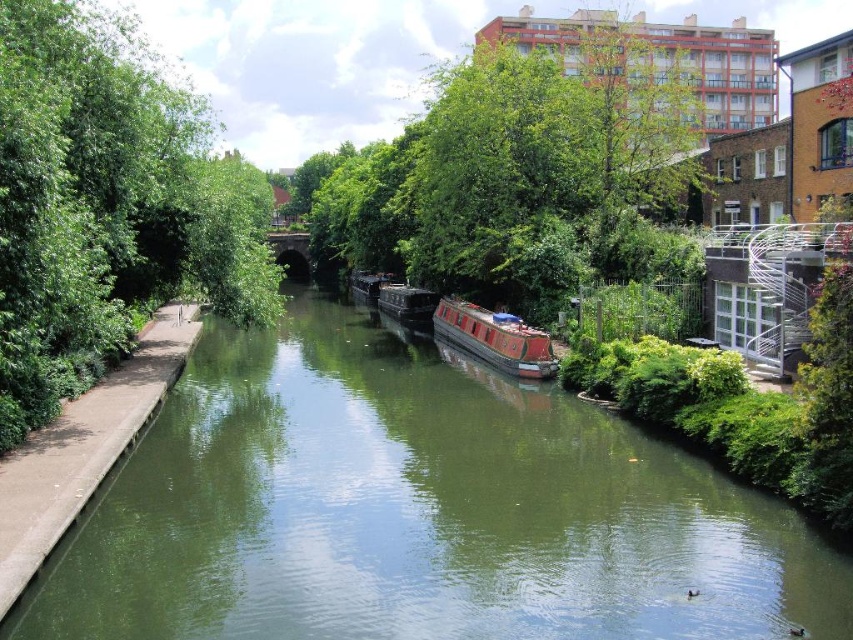
Question: Which point is farther to the camera?

Choices:
 (A) (190, 128)
 (B) (415, 305)
 (C) (850, 564)

Answer: (B)

Question: Which point appears closest to the camera in this image?

Choices:
 (A) (387, 280)
 (B) (194, 272)
 (C) (482, 310)
 (D) (408, 289)

Answer: (B)

Question: Is the position of green leafy tree at upper center more distant than that of red polished wood barge at center?

Choices:
 (A) yes
 (B) no

Answer: (A)

Question: Is green smooth water at center further to the viewer compared to green leafy tree at left?

Choices:
 (A) no
 (B) yes

Answer: (A)

Question: Is green smooth water at center above red polished wood barge at center?

Choices:
 (A) yes
 (B) no

Answer: (B)

Question: Which point is farther from the camera taking this photo?

Choices:
 (A) (606, 244)
 (B) (126, 582)
 (C) (422, 316)

Answer: (C)